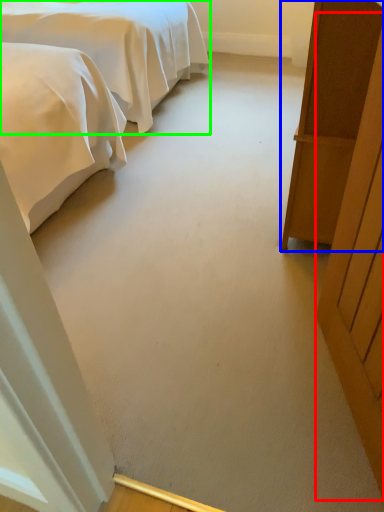
Question: Which is farther away from door (highlighted by a red box)? furniture (highlighted by a blue box) or bed (highlighted by a green box)?

Choices:
 (A) furniture
 (B) bed

Answer: (B)